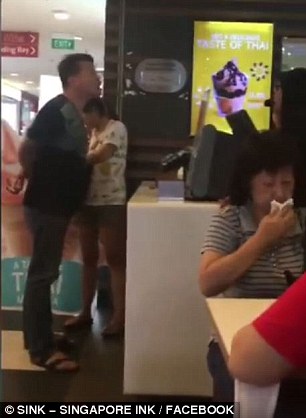
This screenshot has height=418, width=306. Identify the location of countertop. (168, 188).